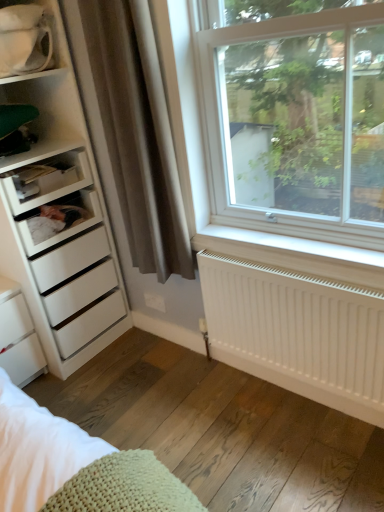
Where is `vacant space to the left of white matte radiator at lower right`? vacant space to the left of white matte radiator at lower right is located at coordinates (187, 400).